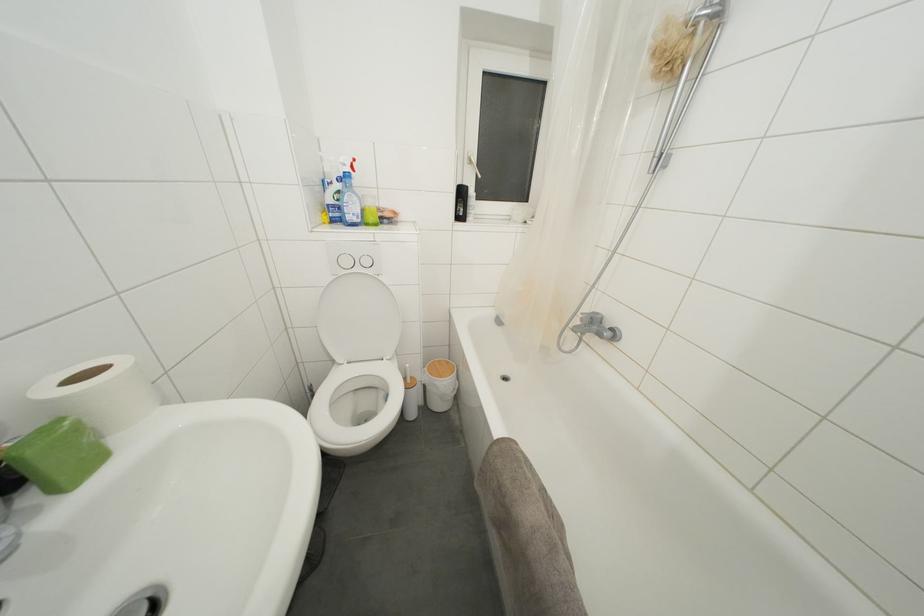
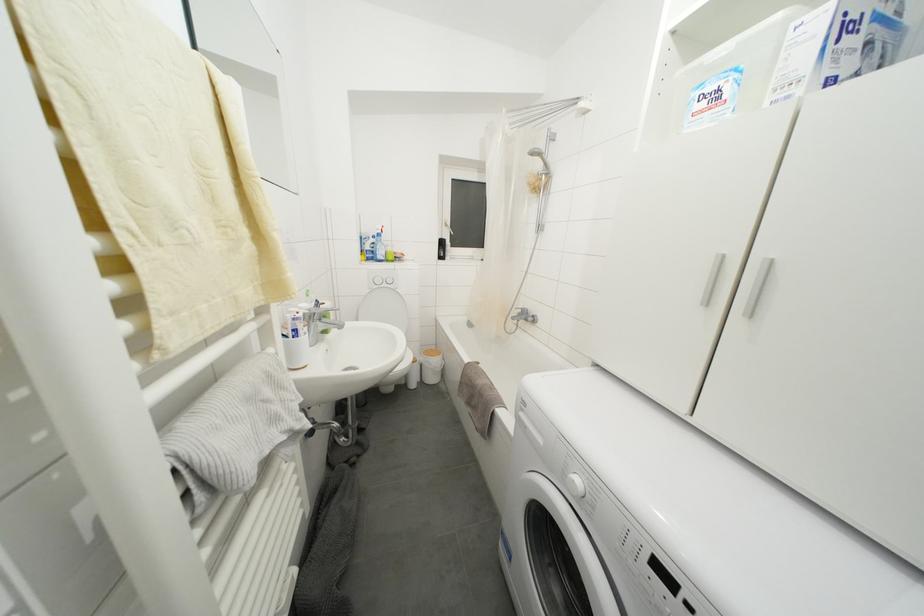
Question: In a continuous first-person perspective shot, in which direction is the camera moving?

Choices:
 (A) Left
 (B) Right
 (C) Forward
 (D) Backward

Answer: (D)